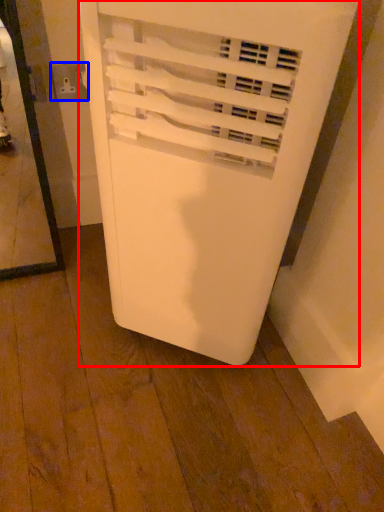
Question: Which point is further to the camera, home appliance (highlighted by a red box) or electric outlet (highlighted by a blue box)?

Choices:
 (A) home appliance
 (B) electric outlet

Answer: (B)